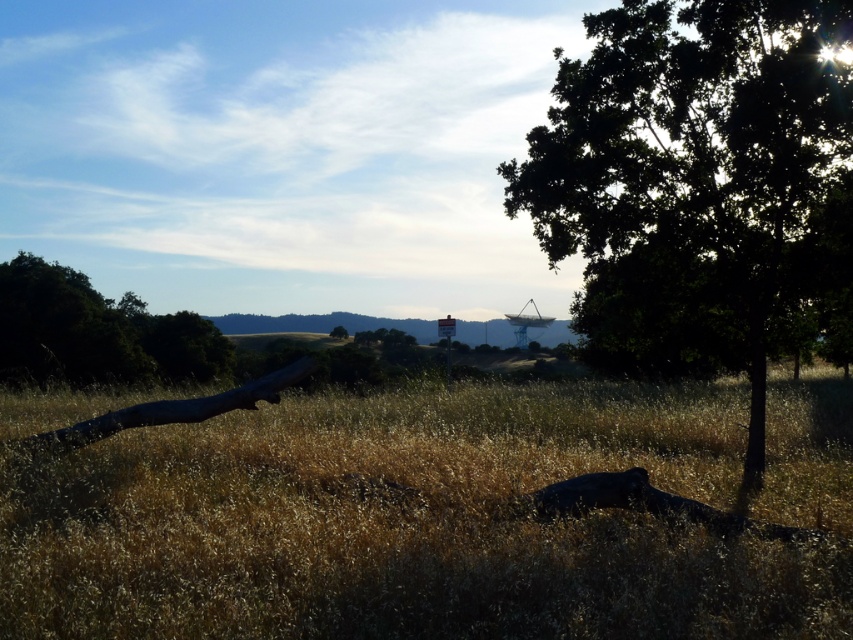
You are standing at the satellite dish and want to walk towards the tree with dense foliage. Which point, point [590,532] or point [601,100], would you pass closer to first?

Point [590,532] is in front of point [601,100], so you would pass closer to point [590,532] first when walking towards the tree with dense foliage.

You are a hiker who wants to cross the field. You see the dry grass at center and the green leafy tree at center. Which one is taller?

The dry grass at center has a lesser height compared to the green leafy tree at center, so the green leafy tree at center is taller.

Looking at this image, you are a hiker trying to cross the field of dry grass at center. There is a green matte tree at center nearby. Which area would be more stable to walk on?

The dry grass at center has a larger size compared to the green matte tree at center, so the dry grass at center would be more stable to walk on because larger areas of grass typically provide firmer footing than smaller objects like trees.